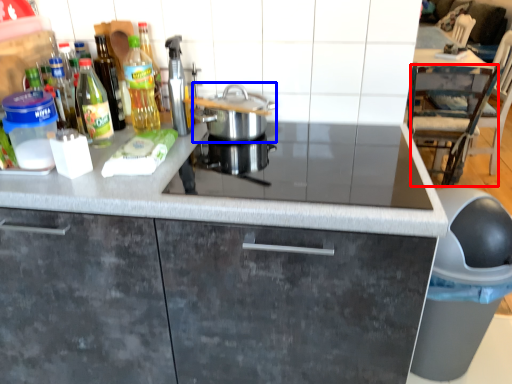
Question: Which object appears farthest to the camera in this image, chair (highlighted by a red box) or kitchen appliance (highlighted by a blue box)?

Choices:
 (A) chair
 (B) kitchen appliance

Answer: (A)